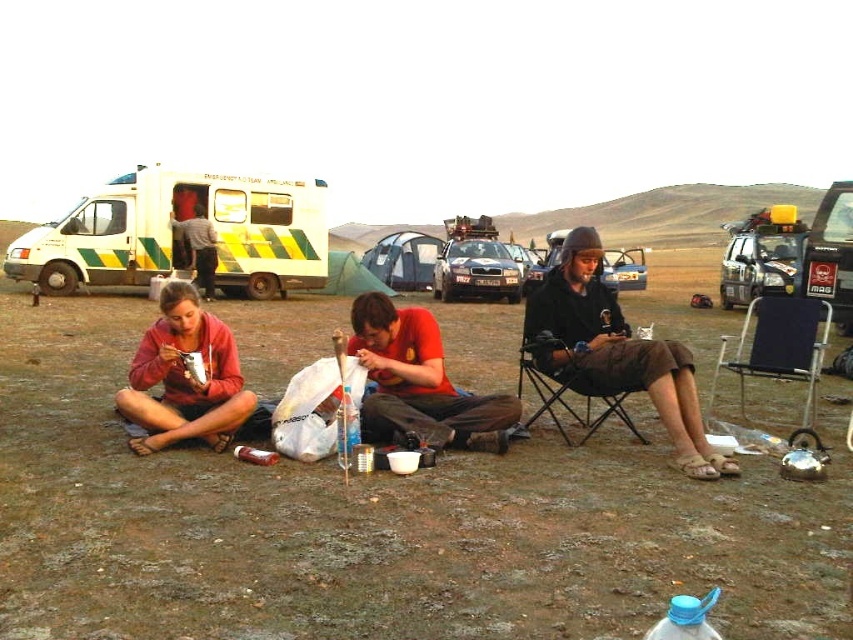
Question: Which point appears closest to the camera in this image?

Choices:
 (A) (172, 376)
 (B) (207, 269)
 (C) (614, 404)

Answer: (A)

Question: Is brown grassy field at center to the left of black fabric folding chair at center from the viewer's perspective?

Choices:
 (A) no
 (B) yes

Answer: (B)

Question: Is white and green striped ambulance at upper left smaller than gray fabric shirt at left?

Choices:
 (A) no
 (B) yes

Answer: (A)

Question: Which object is farther from the camera taking this photo?

Choices:
 (A) white and green striped ambulance at upper left
 (B) black fabric folding chair at center
 (C) gray fabric shirt at left

Answer: (C)

Question: Estimate the real-world distances between objects in this image. Which object is closer to the dark brown fabric jacket at center?

Choices:
 (A) gray fabric shirt at left
 (B) black fabric chair at center
 (C) red cotton shirt at center
 (D) brown grassy field at center

Answer: (B)

Question: Does matte red hoodie at lower left have a smaller size compared to black fabric chair at center?

Choices:
 (A) yes
 (B) no

Answer: (A)